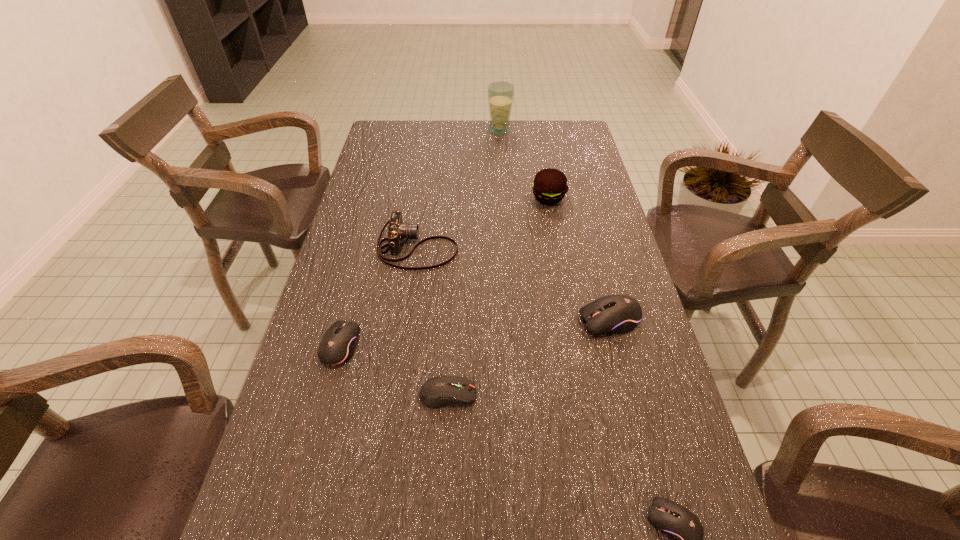
Locate an element on the screen. object identified as the sixth closest to the farthest object is located at coordinates (684, 529).

Select which object appears as the third closest to the fourth object from right to left. Please provide its 2D coordinates. Your answer should be formatted as a tuple, i.e. [(x, y)], where the tuple contains the x and y coordinates of a point satisfying the conditions above.

[(614, 313)]

Image resolution: width=960 pixels, height=540 pixels. Identify the location of computer mouse that can be found as the second closest to the tallest object. (338, 344).

Point out which computer mouse is positioned as the second nearest to the second nearest object. Please provide its 2D coordinates. Your answer should be formatted as a tuple, i.e. [(x, y)], where the tuple contains the x and y coordinates of a point satisfying the conditions above.

[(614, 313)]

Locate which black computer mouse is the closest to the third farthest computer mouse. Please provide its 2D coordinates. Your answer should be formatted as a tuple, i.e. [(x, y)], where the tuple contains the x and y coordinates of a point satisfying the conditions above.

[(338, 344)]

Identify which black computer mouse is located as the nearest to the biggest black computer mouse. Please provide its 2D coordinates. Your answer should be formatted as a tuple, i.e. [(x, y)], where the tuple contains the x and y coordinates of a point satisfying the conditions above.

[(684, 529)]

You are a GUI agent. You are given a task and a screenshot of the screen. Output one action in this format:
    pyautogui.click(x=<x>, y=<y>)
    Task: Click on the free spot that satisfies the following two spatial constraints: 1. on the front side of the sixth shortest object; 2. on the right side of the tallest object
    This screenshot has height=540, width=960.
    Given the screenshot: What is the action you would take?
    pyautogui.click(x=504, y=198)

You are a GUI agent. You are given a task and a screenshot of the screen. Output one action in this format:
    pyautogui.click(x=<x>, y=<y>)
    Task: Click on the vacant region that satisfies the following two spatial constraints: 1. on the front-facing side of the brown camera; 2. on the back side of the tallest computer mouse
    The height and width of the screenshot is (540, 960).
    Given the screenshot: What is the action you would take?
    pyautogui.click(x=407, y=320)